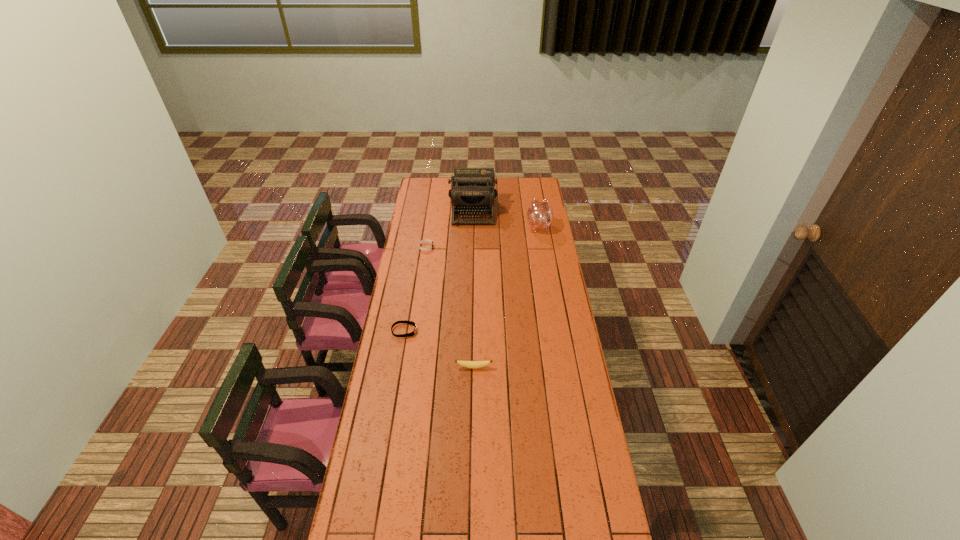
Locate an element on the screen. The height and width of the screenshot is (540, 960). free spot located on the front facing side of the rightmost object is located at coordinates (535, 202).

Where is `free location located on the front facing side of the rightmost object`? free location located on the front facing side of the rightmost object is located at coordinates [x=534, y=194].

The image size is (960, 540). I want to click on vacant space situated on the front facing side of the rightmost object, so click(x=536, y=209).

Where is `vacant space located on the back of the banana`? vacant space located on the back of the banana is located at coordinates (474, 340).

Where is `vacant space situated 0.360m on the outer surface of the taller wristband`? vacant space situated 0.360m on the outer surface of the taller wristband is located at coordinates (498, 247).

You are a GUI agent. You are given a task and a screenshot of the screen. Output one action in this format:
    pyautogui.click(x=<x>, y=<y>)
    Task: Click on the vacant region located 0.250m on the display of the nearer wristband
    The width and height of the screenshot is (960, 540).
    Given the screenshot: What is the action you would take?
    pyautogui.click(x=472, y=331)

This screenshot has width=960, height=540. Identify the location of object that is at the far edge. (472, 192).

Where is `object that is at the right edge`? object that is at the right edge is located at coordinates [x=540, y=215].

In the image, there is a desktop. Where is `vacant space at the left edge`? The width and height of the screenshot is (960, 540). vacant space at the left edge is located at coordinates (438, 203).

Where is `vacant point at the right edge`? The image size is (960, 540). vacant point at the right edge is located at coordinates pyautogui.click(x=599, y=485).